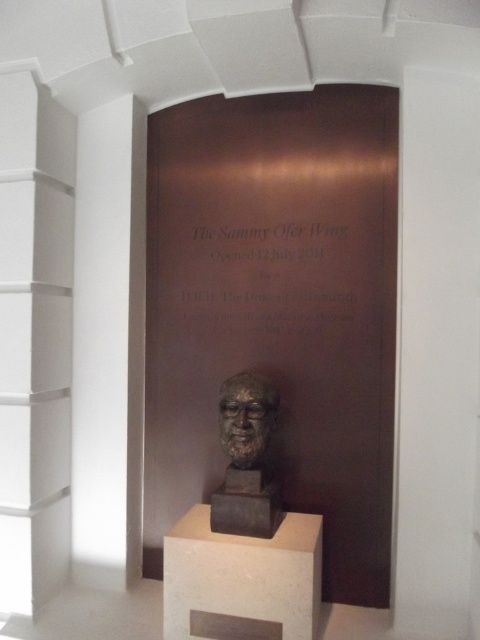
Question: Which point is closer to the camera?

Choices:
 (A) (238, 396)
 (B) (264, 554)

Answer: (B)

Question: Which of the following is the closest to the observer?

Choices:
 (A) (205, 525)
 (B) (212, 636)

Answer: (B)

Question: Which object appears closest to the camera in this image?

Choices:
 (A) bronze/statue at center
 (B) bronze sculpture at center

Answer: (A)

Question: Does bronze bust at center appear on the right side of bronze sculpture at center?

Choices:
 (A) yes
 (B) no

Answer: (A)

Question: Can you confirm if bronze plaque at center is positioned below bronze/statue at center?

Choices:
 (A) yes
 (B) no

Answer: (B)

Question: Is white marble pedestal at center smaller than bronze plaque at center?

Choices:
 (A) yes
 (B) no

Answer: (B)